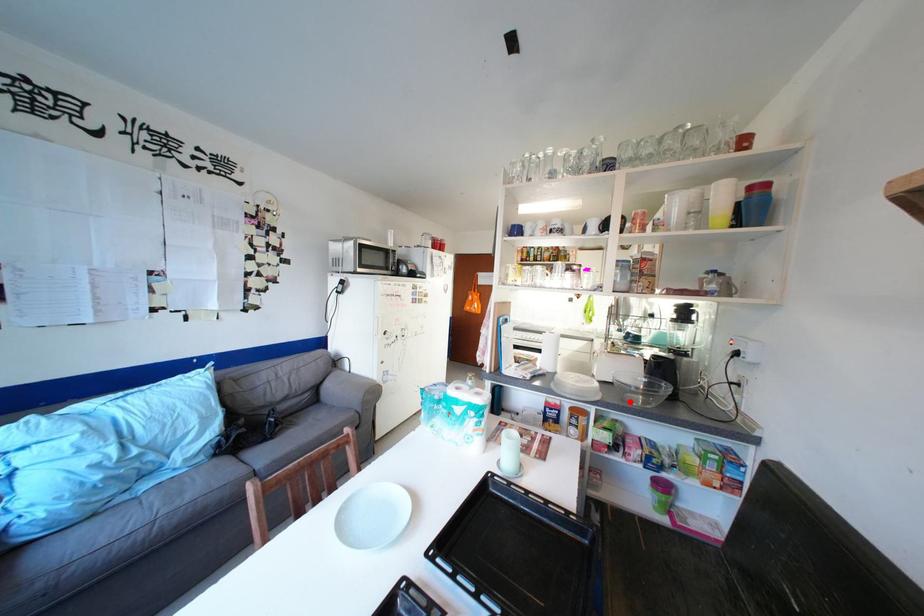
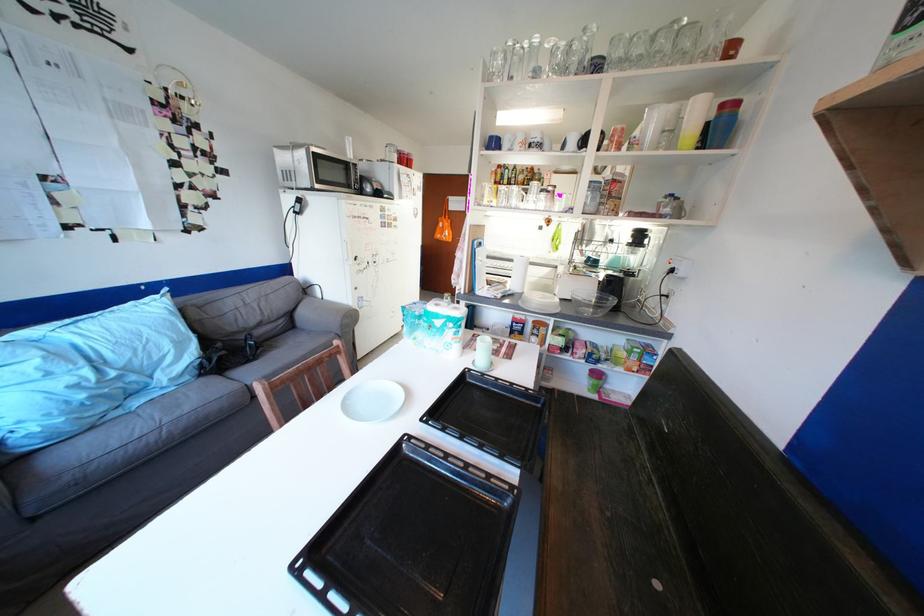
In the second image, find the point that corresponds to the highlighted location in the first image.

(584, 314)